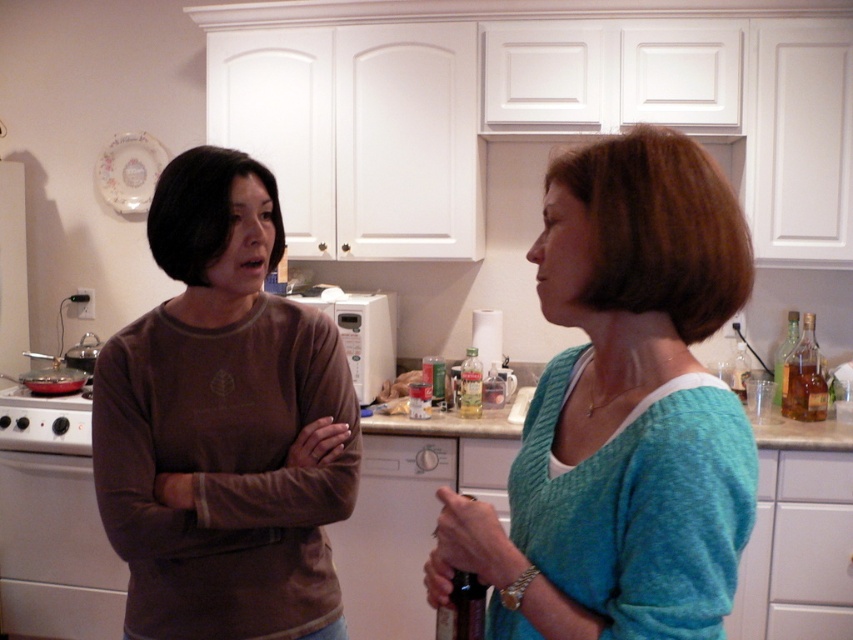
Question: Which of the following is the farthest from the observer?

Choices:
 (A) (576, 182)
 (B) (178, 256)

Answer: (B)

Question: Among these objects, which one is nearest to the camera?

Choices:
 (A) brown matte shirt at left
 (B) teal knitted sweater at center

Answer: (B)

Question: Is teal knitted sweater at center wider than brown matte shirt at left?

Choices:
 (A) yes
 (B) no

Answer: (B)

Question: From the image, what is the correct spatial relationship of teal knitted sweater at center in relation to brown matte shirt at left?

Choices:
 (A) right
 (B) left

Answer: (A)

Question: Is teal knitted sweater at center to the right of brown matte shirt at left from the viewer's perspective?

Choices:
 (A) yes
 (B) no

Answer: (A)

Question: Which object appears farthest from the camera in this image?

Choices:
 (A) brown matte shirt at left
 (B) teal knitted sweater at center

Answer: (A)